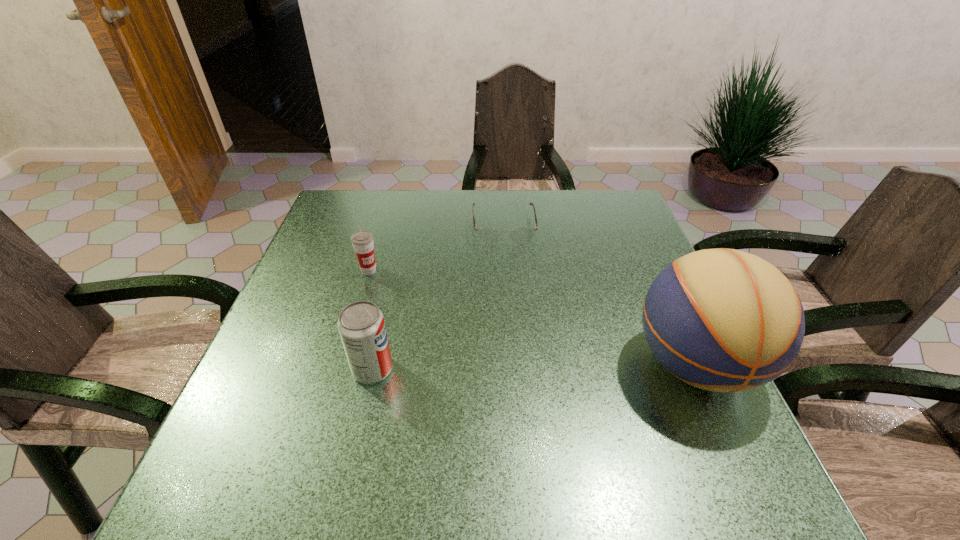
Locate an element on the screen. This screenshot has height=540, width=960. vacant space located on the front-facing side of the farthest object is located at coordinates (514, 315).

Where is `vacant space located 0.320m on the front-facing side of the farthest object`? The image size is (960, 540). vacant space located 0.320m on the front-facing side of the farthest object is located at coordinates [516, 335].

At what (x,y) coordinates should I click in order to perform the action: click on vacant space located on the front-facing side of the farthest object. Please return your answer as a coordinate pair (x, y). Image resolution: width=960 pixels, height=540 pixels. Looking at the image, I should click on (511, 294).

Where is `object that is at the far edge`? object that is at the far edge is located at coordinates (489, 236).

Locate an element on the screen. object located at the near edge is located at coordinates (723, 320).

At what (x,y) coordinates should I click in order to perform the action: click on object that is at the left edge. Please return your answer as a coordinate pair (x, y). This screenshot has width=960, height=540. Looking at the image, I should click on (362, 241).

The height and width of the screenshot is (540, 960). Identify the location of object that is at the right edge. (723, 320).

At what (x,y) coordinates should I click in order to perform the action: click on object that is at the near right corner. Please return your answer as a coordinate pair (x, y). The height and width of the screenshot is (540, 960). Looking at the image, I should click on (723, 320).

At what (x,y) coordinates should I click in order to perform the action: click on vacant space at the far edge. Please return your answer as a coordinate pair (x, y). This screenshot has height=540, width=960. Looking at the image, I should click on (455, 223).

Identify the location of vacant space at the near edge of the desktop. pyautogui.click(x=612, y=419).